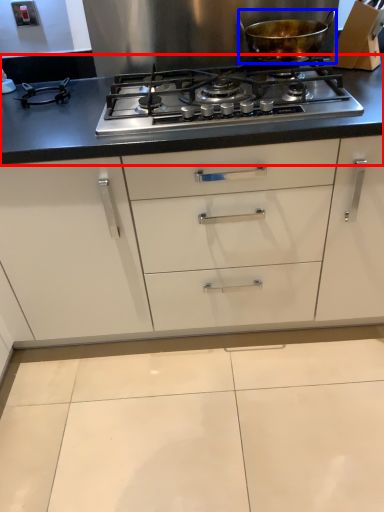
Question: Which of the following is the farthest to the observer, countertop (highlighted by a red box) or kitchen appliance (highlighted by a blue box)?

Choices:
 (A) countertop
 (B) kitchen appliance

Answer: (B)